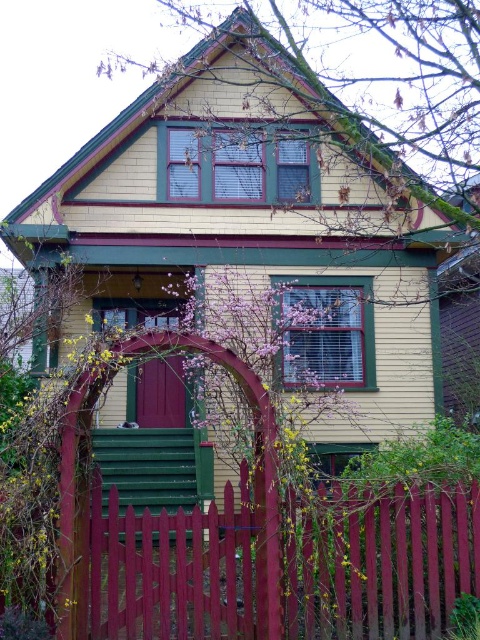
You are a delivery person approaching the house and need to determine which object is bigger between the smooth wooden fence at center and the matte burgundy door at center. Which one is larger?

Result: The smooth wooden fence at center has a larger size compared to the matte burgundy door at center, so the smooth wooden fence at center is larger.

Consider the image. You are standing in front of the house and want to know where the smooth wooden fence at center is located. Can you provide its coordinates?

The smooth wooden fence at center is located at coordinates point (381, 563).